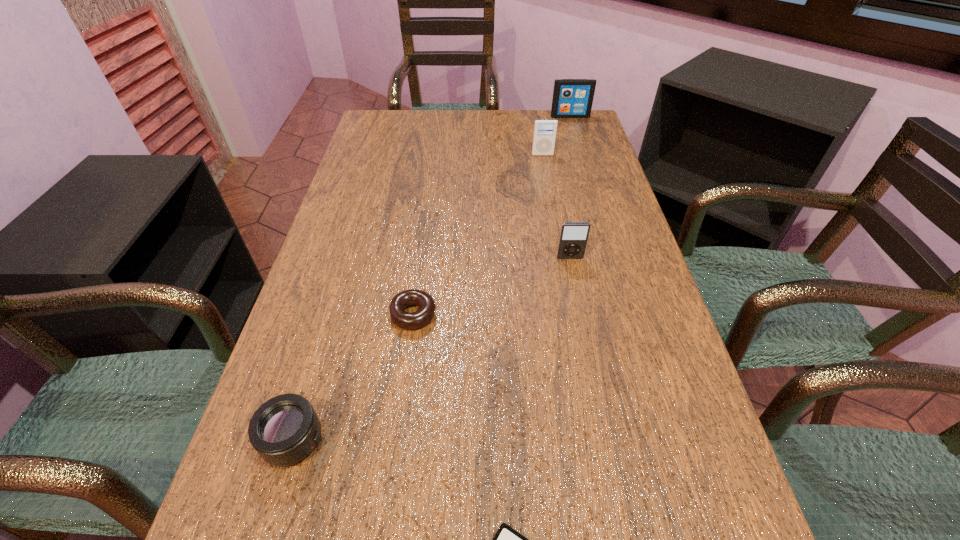
This screenshot has width=960, height=540. I want to click on the farthest object, so click(572, 98).

Where is `the rightmost object`? the rightmost object is located at coordinates (572, 98).

The width and height of the screenshot is (960, 540). Find the location of `the fifth nearest object`. the fifth nearest object is located at coordinates (544, 136).

Identify the location of the third farthest object. This screenshot has width=960, height=540. (573, 238).

Identify the location of the fourth tallest object. (284, 430).

Where is `telephoto lens`? This screenshot has width=960, height=540. telephoto lens is located at coordinates (284, 430).

You are a GUI agent. You are given a task and a screenshot of the screen. Output one action in this format:
    pyautogui.click(x=<x>, y=<y>)
    Task: Click on the second object from left to right
    The height and width of the screenshot is (540, 960).
    Given the screenshot: What is the action you would take?
    pyautogui.click(x=410, y=321)

You are a GUI agent. You are given a task and a screenshot of the screen. Output one action in this format:
    pyautogui.click(x=<x>, y=<y>)
    Task: Click on the fourth farthest object
    The width and height of the screenshot is (960, 540).
    Given the screenshot: What is the action you would take?
    pyautogui.click(x=410, y=321)

Find the location of a particular element. The image size is (960, 540). vacant space located on the front screen of the rightmost iPod is located at coordinates (589, 179).

This screenshot has height=540, width=960. In order to click on free location located 0.330m on the front-facing side of the third nearest iPod in this screenshot , I will do `click(556, 225)`.